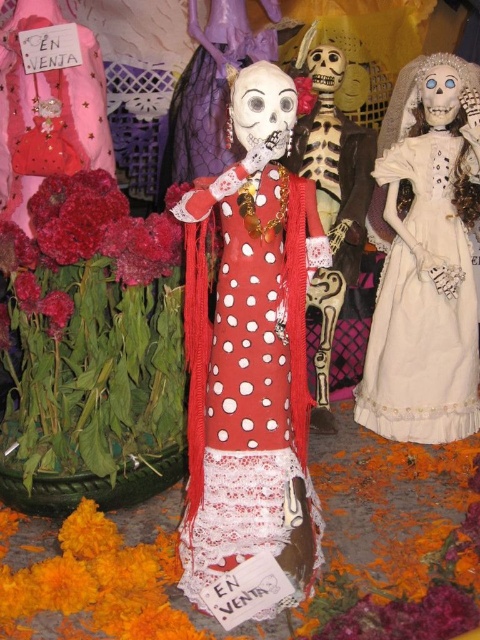
You are a photographer standing in front of the two dresses, the white lace dress at right and the matte polka dot dress at center. You want to capture both dresses in a single photo without moving the camera. Can you fit both dresses into the frame if your camera has a 4 inch wide field of view?

The distance between the white lace dress at right and the matte polka dot dress at center is 4.29 inches. Since the camera has a 4 inch wide field of view, which is narrower than the distance between the two dresses, you cannot fit both dresses into the frame without moving the camera.

You are a photographer standing in front of the central skeleton figure. You want to take a picture of both the white lace dress at right and the matte red flower at center in the same frame. Given that your camera has a minimum focus distance of 15 inches, will you be able to capture both objects clearly without moving closer?

The distance between the white lace dress at right and the matte red flower at center is 14.64 inches. Since this distance is less than the camera minimum focus distance of 15 inches, the photographer will not be able to capture both objects clearly without moving closer.